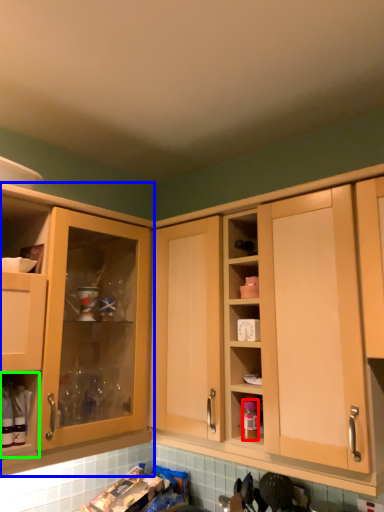
Question: Considering the real-world distances, which object is farthest from bottle (highlighted by a red box)? cabinetry (highlighted by a blue box) or cabinet (highlighted by a green box)?

Choices:
 (A) cabinetry
 (B) cabinet

Answer: (B)